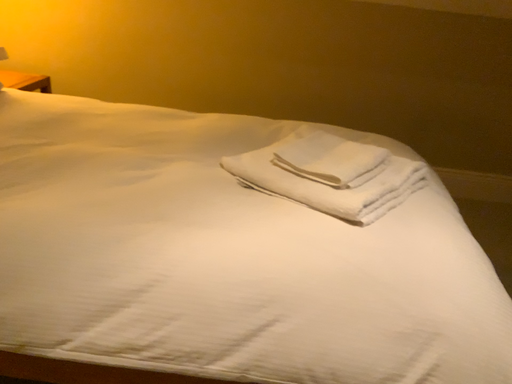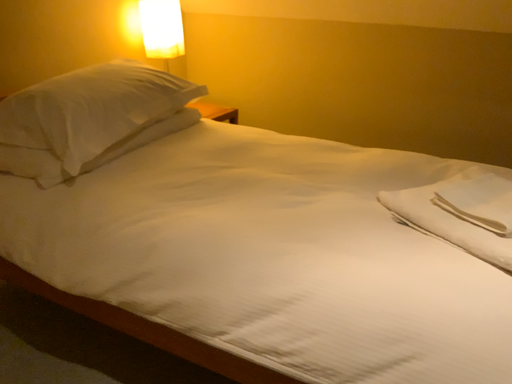
Question: Which way did the camera rotate in the video?

Choices:
 (A) rotated left
 (B) rotated right

Answer: (A)